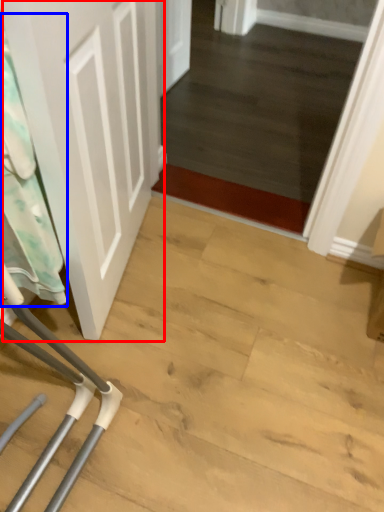
Question: Which object appears farthest to the camera in this image, door (highlighted by a red box) or laundry (highlighted by a blue box)?

Choices:
 (A) door
 (B) laundry

Answer: (B)